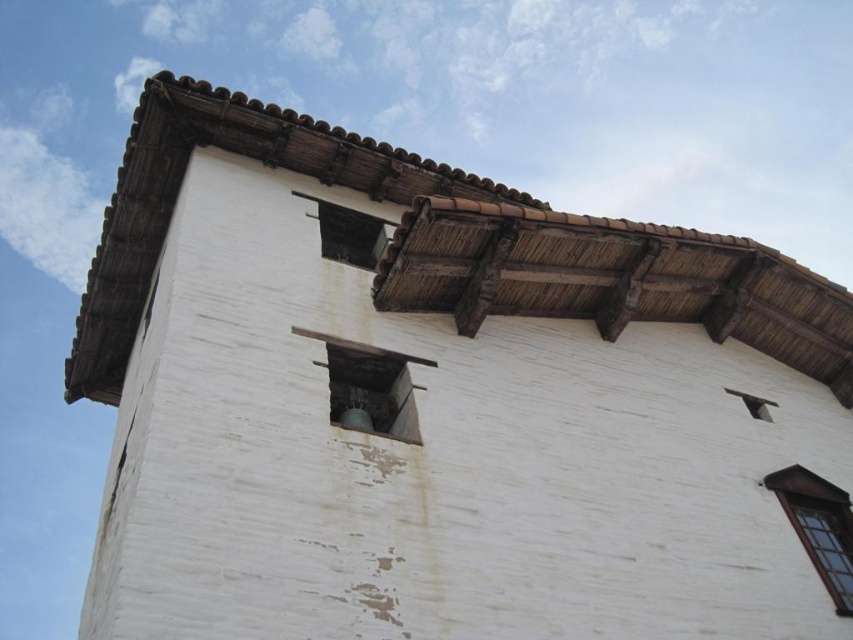
You are standing at the base of the building and looking up at the dark wood window at upper right. What are the coordinates of its position in the 2D image?

The coordinates of the dark wood window at upper right are at point [819,525].

You are standing at the base of the building and want to take a photo of the wooden window at upper center and the transparent glass window at upper left. If your camera can focus on objects up to 10 meters away, will both windows be in focus?

The wooden window at upper center is 12.83 meters away from transparent glass window at upper left. Since the distance between them is more than 10 meters, the camera cannot focus on both at the same time.